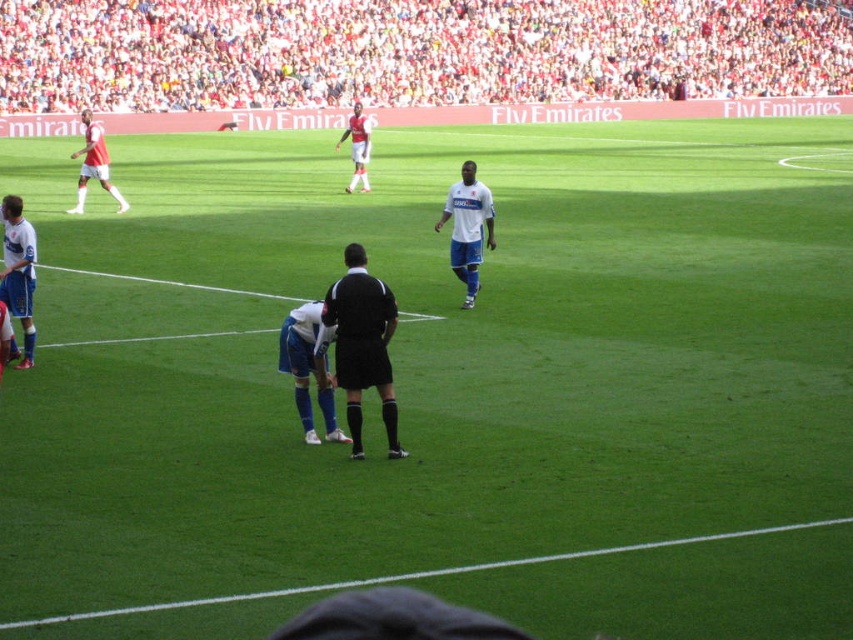
Question: Does green grass at lower center come in front of white jersey at left?

Choices:
 (A) no
 (B) yes

Answer: (B)

Question: Is white matte soccer player at center bigger than white jersey at left?

Choices:
 (A) no
 (B) yes

Answer: (A)

Question: Among these points, which one is nearest to the camera?

Choices:
 (A) (26, 276)
 (B) (38, 259)
 (C) (91, 612)

Answer: (C)

Question: Which of the following is the farthest from the observer?

Choices:
 (A) (489, 209)
 (B) (170, 604)
 (C) (360, 442)
 (D) (357, 152)

Answer: (D)

Question: Which object is the closest to the white jersey at center?

Choices:
 (A) white fabric crowd at upper center
 (B) matte white shorts at left
 (C) black matte referee at center
 (D) white matte soccer player at center

Answer: (B)

Question: Is white fabric crowd at upper center smaller than white jersey at left?

Choices:
 (A) no
 (B) yes

Answer: (A)